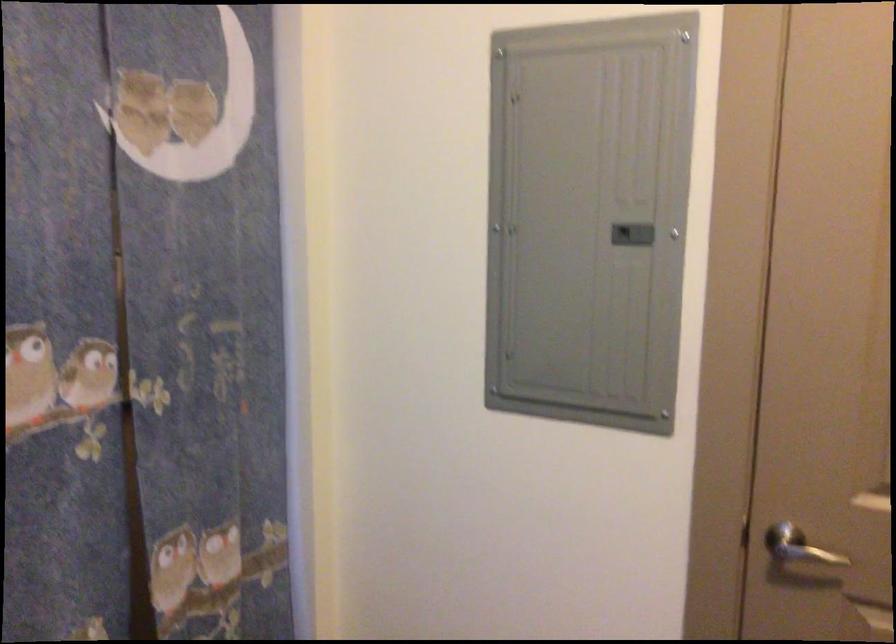
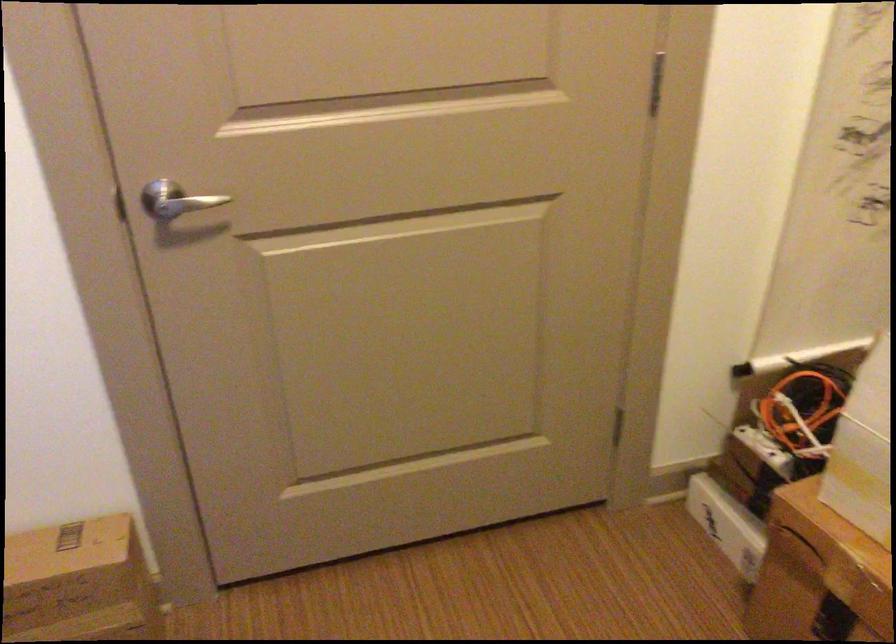
Where in the second image is the point corresponding to point (804, 554) from the first image?

(176, 200)